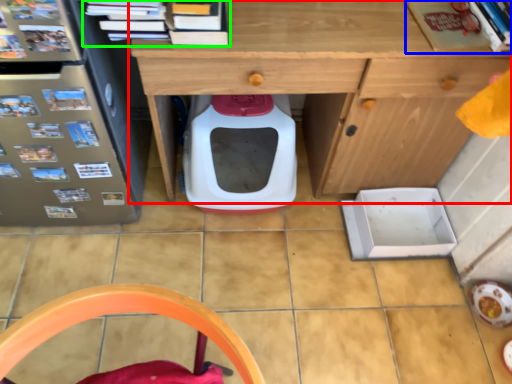
Question: Which is nearer to the desk (highlighted by a red box)? book (highlighted by a blue box) or book (highlighted by a green box).

Choices:
 (A) book
 (B) book

Answer: (A)